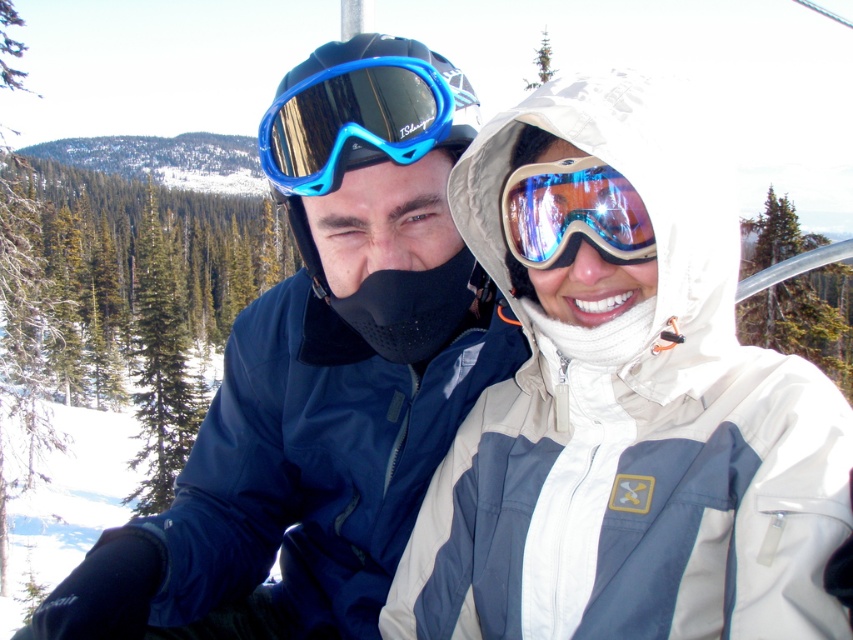
Who is higher up, white matte jacket at center or blue reflective plastic goggles at upper center?

blue reflective plastic goggles at upper center is higher up.

Does white matte jacket at center have a lesser height compared to blue reflective plastic goggles at upper center?

In fact, white matte jacket at center may be taller than blue reflective plastic goggles at upper center.

Where is `white matte jacket at center`? white matte jacket at center is located at coordinates (624, 401).

What are the coordinates of `white matte jacket at center` in the screenshot? It's located at (624, 401).

This screenshot has width=853, height=640. Describe the element at coordinates (624, 401) in the screenshot. I see `white matte jacket at center` at that location.

Is white matte jacket at center wider than shiny reflective ski goggles at center?

Correct, the width of white matte jacket at center exceeds that of shiny reflective ski goggles at center.

Who is more forward, (506, 131) or (523, 248)?

Positioned in front is point (506, 131).

Where is `white matte jacket at center`? white matte jacket at center is located at coordinates (624, 401).

Who is positioned more to the right, matte blue ski goggles at center or shiny reflective ski goggles at center?

shiny reflective ski goggles at center is more to the right.

Is matte blue ski goggles at center further to camera compared to shiny reflective ski goggles at center?

Yes, it is.

Image resolution: width=853 pixels, height=640 pixels. Identify the location of matte blue ski goggles at center. (320, 376).

You are a GUI agent. You are given a task and a screenshot of the screen. Output one action in this format:
    pyautogui.click(x=<x>, y=<y>)
    Task: Click on the matte blue ski goggles at center
    The image size is (853, 640).
    Given the screenshot: What is the action you would take?
    pyautogui.click(x=320, y=376)